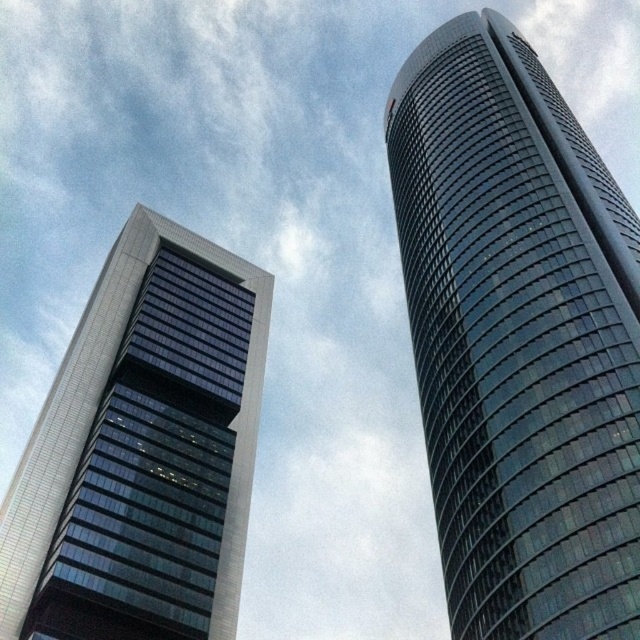
Can you confirm if shiny glass skyscraper at right is shorter than matte glass skyscraper at left?

In fact, shiny glass skyscraper at right may be taller than matte glass skyscraper at left.

Between shiny glass skyscraper at right and matte glass skyscraper at left, which one appears on the right side from the viewer's perspective?

Positioned to the right is shiny glass skyscraper at right.

Does point (412, 275) come closer to viewer compared to point (205, 406)?

No, (412, 275) is further to viewer.

The image size is (640, 640). In order to click on shiny glass skyscraper at right in this screenshot , I will do `click(518, 339)`.